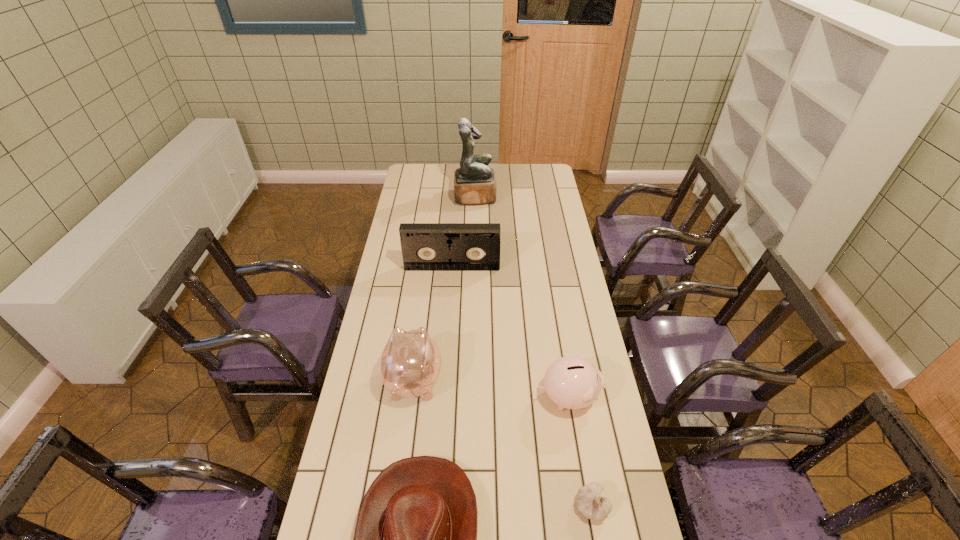
Locate an element on the screen. The image size is (960, 540). object that can be found as the closest to the sculpture is located at coordinates (425, 246).

The height and width of the screenshot is (540, 960). I want to click on vacant space that satisfies the following two spatial constraints: 1. on the front side of the garlic; 2. on the left side of the right piggy bank, so click(585, 506).

The width and height of the screenshot is (960, 540). In order to click on free region that satisfies the following two spatial constraints: 1. in a relaxed pose on the tallest object; 2. on the front side of the second farthest object in this screenshot , I will do `click(474, 267)`.